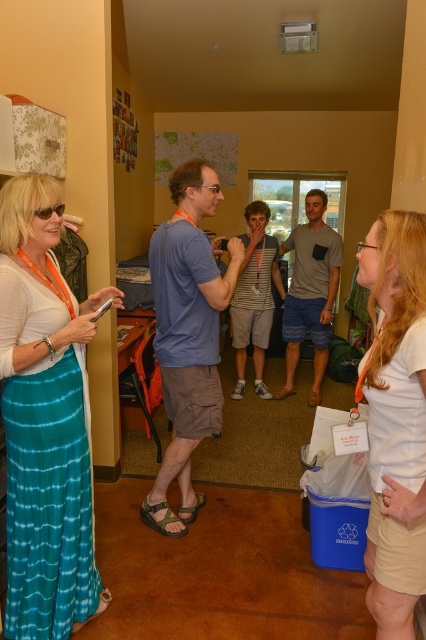
Question: Which of these objects is positioned farthest from the blue cotton t-shirt at center?

Choices:
 (A) gray cotton t-shirt at center
 (B) white cotton shirt at right
 (C) teal tie-dye skirt at left

Answer: (A)

Question: Which object is positioned farthest from the blue cotton t-shirt at center?

Choices:
 (A) white cotton shirt at right
 (B) teal tie-dye skirt at left

Answer: (A)

Question: Based on their relative distances, which object is nearer to the blue cotton t-shirt at center?

Choices:
 (A) teal tie-dye skirt at left
 (B) white cotton shirt at right

Answer: (A)

Question: Does white cotton shirt at right lie behind gray cotton t-shirt at center?

Choices:
 (A) no
 (B) yes

Answer: (A)

Question: Can you confirm if blue cotton t-shirt at center is wider than gray cotton t-shirt at center?

Choices:
 (A) no
 (B) yes

Answer: (B)

Question: Can you confirm if teal tie-dye skirt at left is wider than gray cotton t-shirt at center?

Choices:
 (A) yes
 (B) no

Answer: (B)